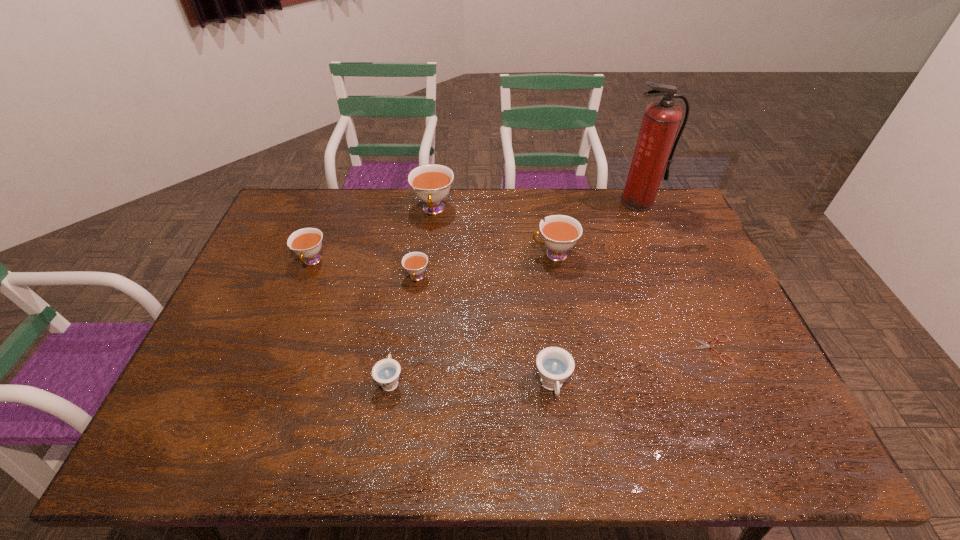
Identify the location of vacant space located 0.100m on the side of the smallest white teacup with the handle. (412, 314).

The width and height of the screenshot is (960, 540). I want to click on vacant space located on the side of the smaller blue teacup with the handle, so click(406, 281).

Image resolution: width=960 pixels, height=540 pixels. I want to click on free space located 0.320m on the side of the smaller blue teacup with the handle, so click(x=407, y=276).

The image size is (960, 540). I want to click on free region located 0.260m on the side of the smaller blue teacup with the handle, so click(405, 291).

This screenshot has height=540, width=960. In order to click on vacant space located 0.150m on the back of the shears in this screenshot , I will do `click(689, 294)`.

Locate an element on the screen. This screenshot has height=540, width=960. fire extinguisher that is at the far edge is located at coordinates (661, 120).

Identify the location of teacup at the far edge. The image size is (960, 540). (431, 183).

Where is `object that is at the left edge`? This screenshot has width=960, height=540. object that is at the left edge is located at coordinates (306, 242).

Where is `fire extinguisher situated at the right edge`? fire extinguisher situated at the right edge is located at coordinates (661, 120).

In order to click on shears positioned at the right edge in this screenshot , I will do `click(705, 345)`.